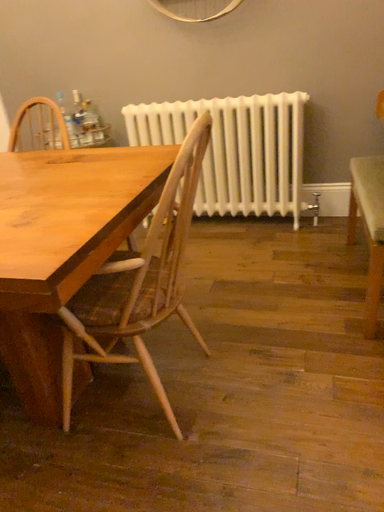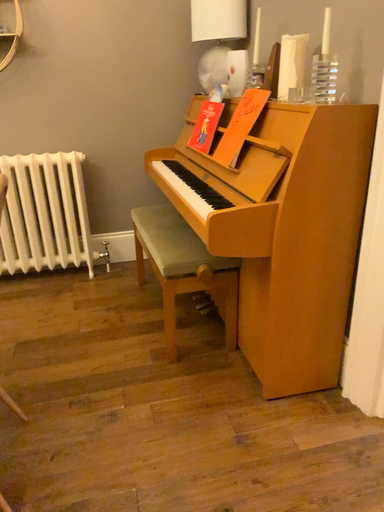
Question: How did the camera likely rotate when shooting the video?

Choices:
 (A) rotated left
 (B) rotated right

Answer: (B)